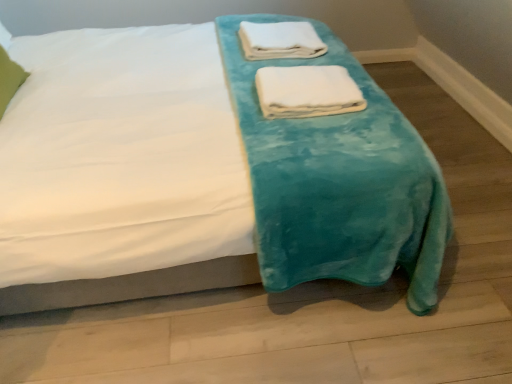
Question: From a real-world perspective, is white soft towel at center, which ranks as the 1th towel in bottom-to-top order, below white soft towel at upper center, which is the 2th towel from front to back?

Choices:
 (A) yes
 (B) no

Answer: (A)

Question: Does white soft towel at center, the 1th towel when ordered from front to back, have a smaller size compared to white soft towel at upper center, the 1th towel in the back-to-front sequence?

Choices:
 (A) no
 (B) yes

Answer: (B)

Question: Does white soft towel at center, the 1th towel when ordered from front to back, have a lesser height compared to white soft towel at upper center, acting as the 1th towel starting from the top?

Choices:
 (A) no
 (B) yes

Answer: (B)

Question: Is white soft towel at center, acting as the 2th towel starting from the top, to the left of white soft towel at upper center, the second towel when ordered from bottom to top, from the viewer's perspective?

Choices:
 (A) yes
 (B) no

Answer: (B)

Question: Does white soft towel at center, the 2th towel in the back-to-front sequence, have a greater width compared to white soft towel at upper center, which is the 2th towel from front to back?

Choices:
 (A) yes
 (B) no

Answer: (B)

Question: Is green fabric pillow at upper left bigger or smaller than white soft towel at upper center, the second towel when ordered from bottom to top?

Choices:
 (A) big
 (B) small

Answer: (A)

Question: Considering the positions of green fabric pillow at upper left and white soft towel at upper center, the 1th towel in the back-to-front sequence, in the image, is green fabric pillow at upper left taller or shorter than white soft towel at upper center, the 1th towel in the back-to-front sequence,?

Choices:
 (A) tall
 (B) short

Answer: (A)

Question: Is point (8, 69) positioned closer to the camera than point (272, 44)?

Choices:
 (A) farther
 (B) closer

Answer: (B)

Question: In the image, is green fabric pillow at upper left positioned in front of or behind white soft towel at upper center, which is the 2th towel from front to back?

Choices:
 (A) front
 (B) behind

Answer: (A)

Question: Is green fabric pillow at upper left taller or shorter than white soft towel at center, the 1th towel when ordered from front to back?

Choices:
 (A) tall
 (B) short

Answer: (A)

Question: Is green fabric pillow at upper left inside the boundaries of white soft towel at center, the 2th towel in the back-to-front sequence, or outside?

Choices:
 (A) outside
 (B) inside

Answer: (A)

Question: Is green fabric pillow at upper left in front of or behind white soft towel at center, the 1th towel when ordered from front to back, in the image?

Choices:
 (A) behind
 (B) front

Answer: (B)

Question: From a real-world perspective, is green fabric pillow at upper left physically located above or below white soft towel at center, the 1th towel when ordered from front to back?

Choices:
 (A) below
 (B) above

Answer: (B)

Question: Based on their sizes in the image, would you say white soft towel at upper center, the 1th towel in the back-to-front sequence, is bigger or smaller than teal plush blanket at center?

Choices:
 (A) big
 (B) small

Answer: (B)

Question: Would you say white soft towel at upper center, acting as the 1th towel starting from the top, is inside or outside teal plush blanket at center?

Choices:
 (A) outside
 (B) inside

Answer: (B)